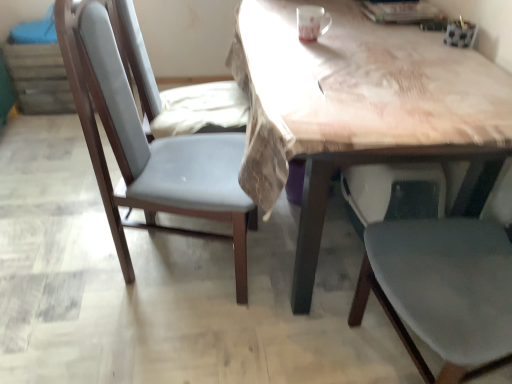
The image size is (512, 384). What are the coordinates of `vacant space underneath matte gray chair at center (from a real-world perspective)` in the screenshot? It's located at (186, 263).